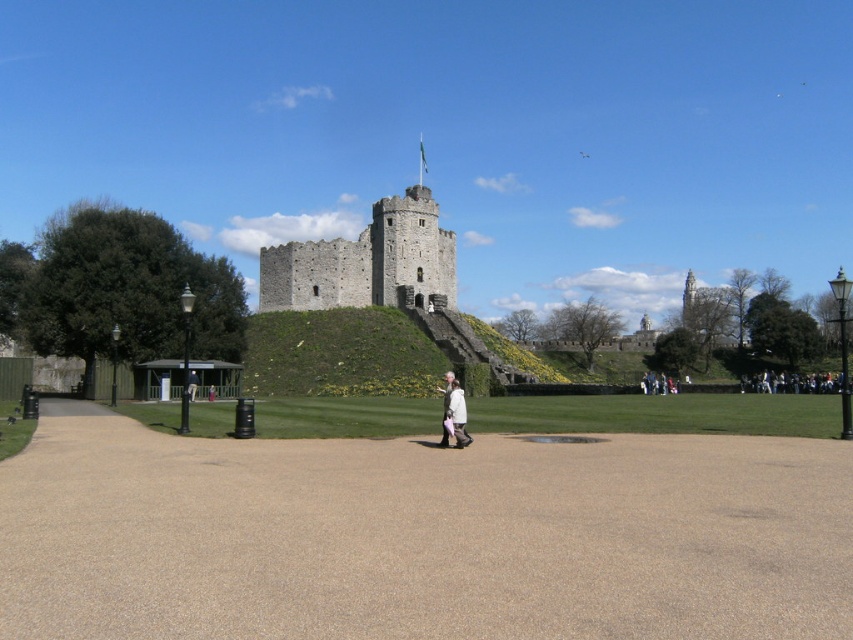
Identify the location of brown gravel path at center. (421, 536).

Identify the location of brown gravel path at center. (421, 536).

Locate an element on the screen. This screenshot has height=640, width=853. gray stone castle at center is located at coordinates click(x=364, y=260).

Can you confirm if gray stone castle at center is bigger than white fabric at center?

Yes, gray stone castle at center is bigger than white fabric at center.

Is point (399, 257) positioned after point (456, 420)?

Yes, it is behind point (456, 420).

Where is `gray stone castle at center`? gray stone castle at center is located at coordinates (364, 260).

Between brown gravel path at center and brown leather jacket at center, which one appears on the right side from the viewer's perspective?

brown gravel path at center is more to the right.

Does brown gravel path at center have a greater height compared to brown leather jacket at center?

In fact, brown gravel path at center may be shorter than brown leather jacket at center.

Does point (821, 456) come closer to viewer compared to point (193, 372)?

Yes, it is in front of point (193, 372).

Identify the location of brown gravel path at center. (421, 536).